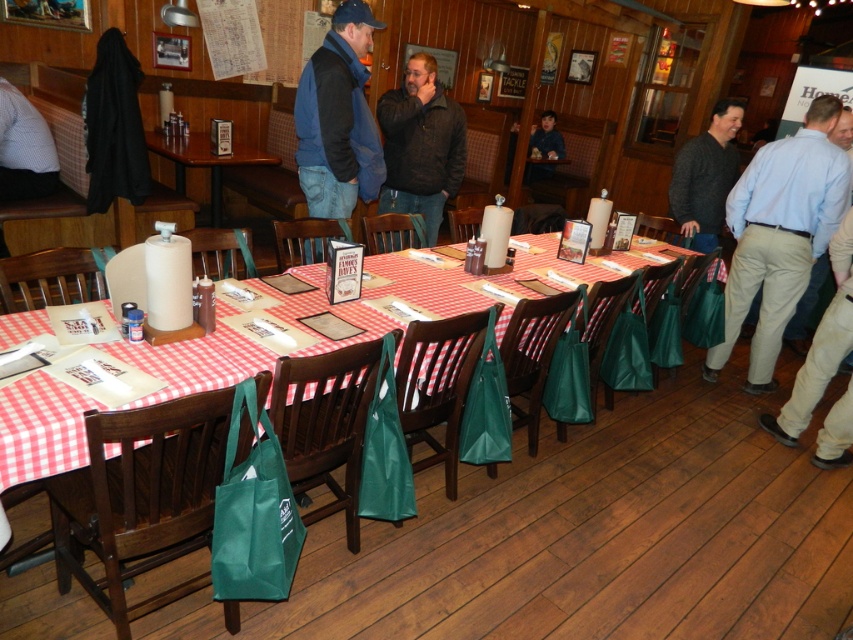
Does point (370, 289) lie behind point (300, 113)?

No, it is in front of (300, 113).

Which is behind, point (459, 291) or point (347, 184)?

The point (347, 184) is behind.

What do you see at coordinates (351, 312) in the screenshot? I see `red checkered tablecloth at center` at bounding box center [351, 312].

Locate an element on the screen. red checkered tablecloth at center is located at coordinates (351, 312).

Can you confirm if red checkered tablecloth at center is shorter than dark gray sweater at right?

Correct, red checkered tablecloth at center is not as tall as dark gray sweater at right.

Between point (376, 260) and point (712, 166), which one is positioned in front?

Point (376, 260)

Locate an element on the screen. The image size is (853, 640). red checkered tablecloth at center is located at coordinates (351, 312).

Is red checkered tablecloth at center thinner than light blue shirt at right?

No, red checkered tablecloth at center is not thinner than light blue shirt at right.

Can you confirm if red checkered tablecloth at center is wider than light blue shirt at right?

Yes, red checkered tablecloth at center is wider than light blue shirt at right.

What do you see at coordinates (351, 312) in the screenshot? The width and height of the screenshot is (853, 640). I see `red checkered tablecloth at center` at bounding box center [351, 312].

I want to click on red checkered tablecloth at center, so click(x=351, y=312).